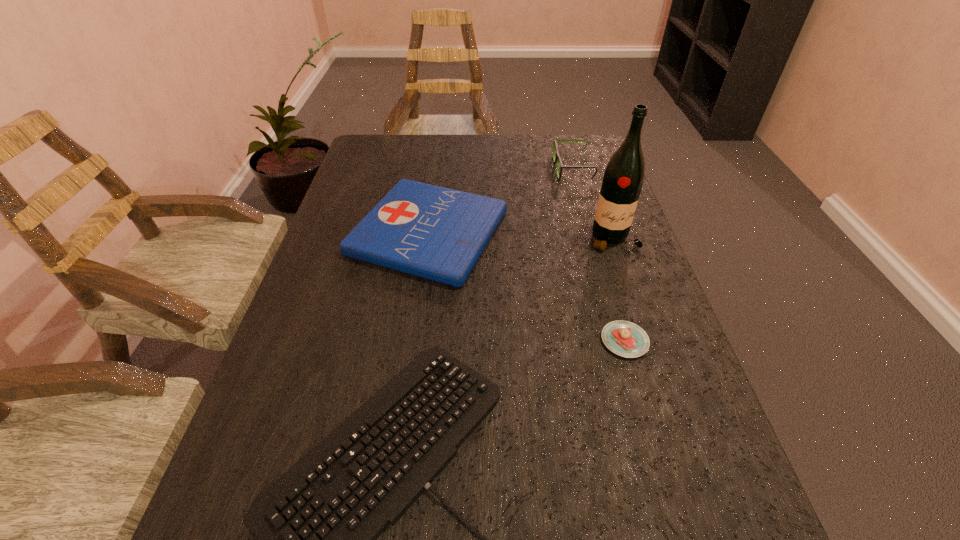
You are a GUI agent. You are given a task and a screenshot of the screen. Output one action in this format:
    pyautogui.click(x=<x>, y=<y>)
    Task: Click on the tallest object
    
    Given the screenshot: What is the action you would take?
    pyautogui.click(x=624, y=174)

Locate an element on the screen. The width and height of the screenshot is (960, 540). the farthest object is located at coordinates click(x=557, y=159).

The height and width of the screenshot is (540, 960). In order to click on spectacles in this screenshot , I will do `click(557, 159)`.

This screenshot has width=960, height=540. In order to click on the first-aid kit in this screenshot , I will do `click(437, 233)`.

This screenshot has width=960, height=540. In order to click on the fourth tallest object in this screenshot , I will do `click(624, 338)`.

Where is `free space located 0.090m on the surface of the tallest object`? Image resolution: width=960 pixels, height=540 pixels. free space located 0.090m on the surface of the tallest object is located at coordinates (629, 283).

Where is `vacant region located on the lens of the spectacles`? The image size is (960, 540). vacant region located on the lens of the spectacles is located at coordinates (431, 169).

Locate an element on the screen. This screenshot has width=960, height=540. vacant space located 0.100m on the lens of the spectacles is located at coordinates (521, 169).

At what (x,y) coordinates should I click in order to perform the action: click on free region located on the lens of the spectacles. Please return your answer as a coordinate pair (x, y). This screenshot has height=540, width=960. Looking at the image, I should click on click(x=485, y=169).

The image size is (960, 540). What are the coordinates of `free space located on the right of the third shortest object` in the screenshot? It's located at (612, 233).